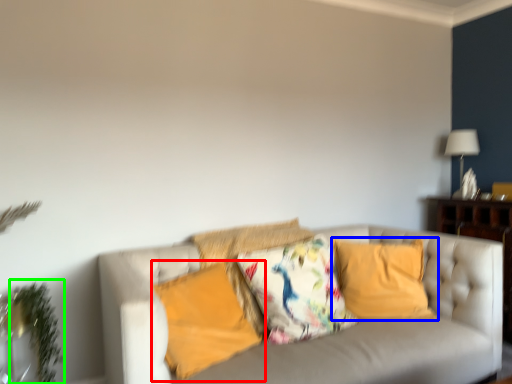
Question: Based on their relative distances, which object is farther from pillow (highlighted by a red box)? Choose from pillow (highlighted by a blue box) and plant (highlighted by a green box).

Choices:
 (A) pillow
 (B) plant

Answer: (A)